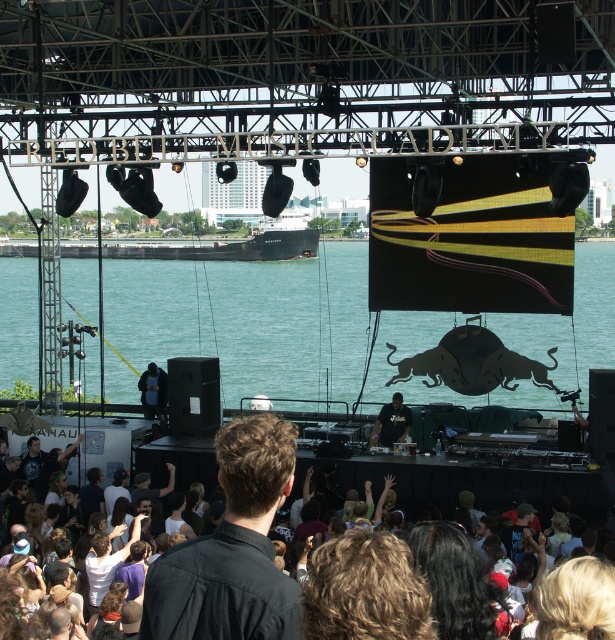
Can you confirm if green water at center is bigger than dark blue fabric at center?

Correct, green water at center is larger in size than dark blue fabric at center.

Is green water at center above dark blue fabric at center?

Indeed, green water at center is positioned over dark blue fabric at center.

The image size is (615, 640). I want to click on green water at center, so click(247, 320).

The height and width of the screenshot is (640, 615). In order to click on black matte shirt at center in this screenshot , I will do `click(391, 422)`.

Measure the distance between black matte shirt at center and camera.

black matte shirt at center and camera are 252.98 feet apart.

Describe the element at coordinates (391, 422) in the screenshot. I see `black matte shirt at center` at that location.

This screenshot has height=640, width=615. I want to click on black matte shirt at center, so click(x=391, y=422).

Between green water at center and black matte shirt at center, which one has more height?

Standing taller between the two is green water at center.

Which is behind, point (538, 337) or point (386, 428)?

The point (538, 337) is more distant.

This screenshot has width=615, height=640. Identify the location of green water at center. (247, 320).